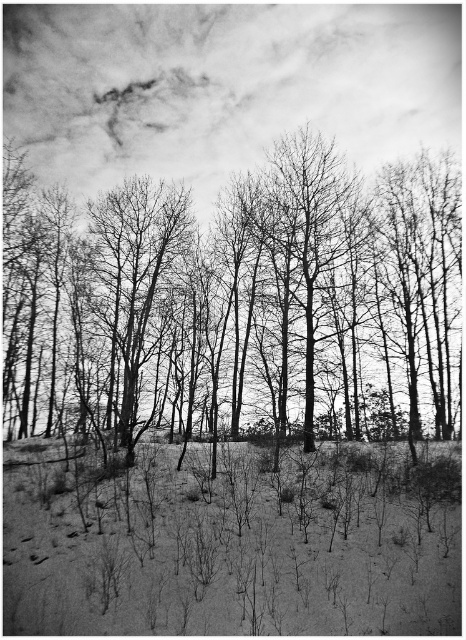
Can you confirm if smooth bark trees at center is bigger than smooth bark tree at center?

Correct, smooth bark trees at center is larger in size than smooth bark tree at center.

What do you see at coordinates (233, 300) in the screenshot? I see `smooth bark trees at center` at bounding box center [233, 300].

Describe the element at coordinates (233, 300) in the screenshot. I see `smooth bark trees at center` at that location.

Where is `smooth bark trees at center`? smooth bark trees at center is located at coordinates (233, 300).